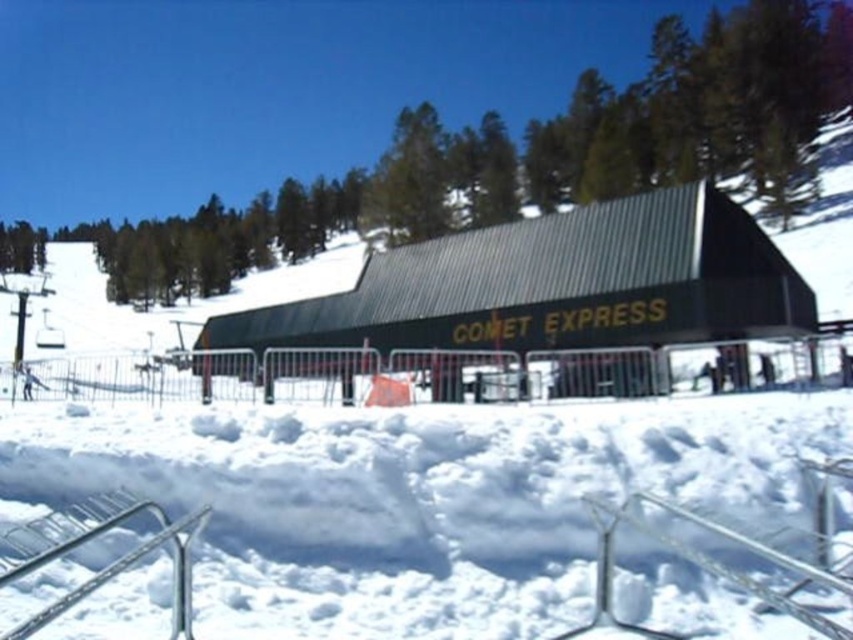
You are a maintenance worker tasked with checking the metallic silver rail at lower left and the metallic silver rail at lower center. Which rail has a greater width?

The metallic silver rail at lower left has a greater width than the metallic silver rail at lower center.

You are a skier who just arrived at the ski resort and want to take the Comet Express lift. You see the white fluffy snow at center and the metallic silver rail at lower center. Which object is closer to you as you approach the lift?

The white fluffy snow at center is closer to you because the metallic silver rail at lower center is behind it.